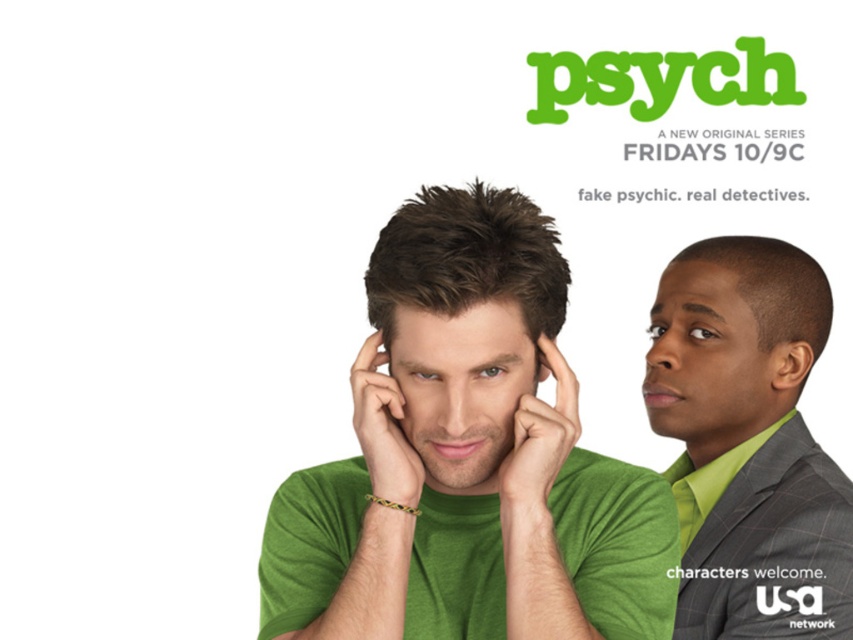
Question: Which object is the closest to the green matte bracelet at center?

Choices:
 (A) green matte t-shirt at center
 (B) matte green jaw at center

Answer: (B)

Question: Is green textured suit at right to the right of green matte hand at center from the viewer's perspective?

Choices:
 (A) no
 (B) yes

Answer: (B)

Question: Which of the following is the farthest from the observer?

Choices:
 (A) (544, 465)
 (B) (376, 486)
 (C) (367, 522)
 (D) (791, 432)

Answer: (D)

Question: Which point is closer to the camera taking this photo?

Choices:
 (A) (395, 508)
 (B) (440, 445)

Answer: (A)

Question: Where is green textured suit at right located in relation to matte green jaw at center in the image?

Choices:
 (A) right
 (B) left

Answer: (A)

Question: Can you confirm if green textured suit at right is bigger than green matte hand at center?

Choices:
 (A) no
 (B) yes

Answer: (B)